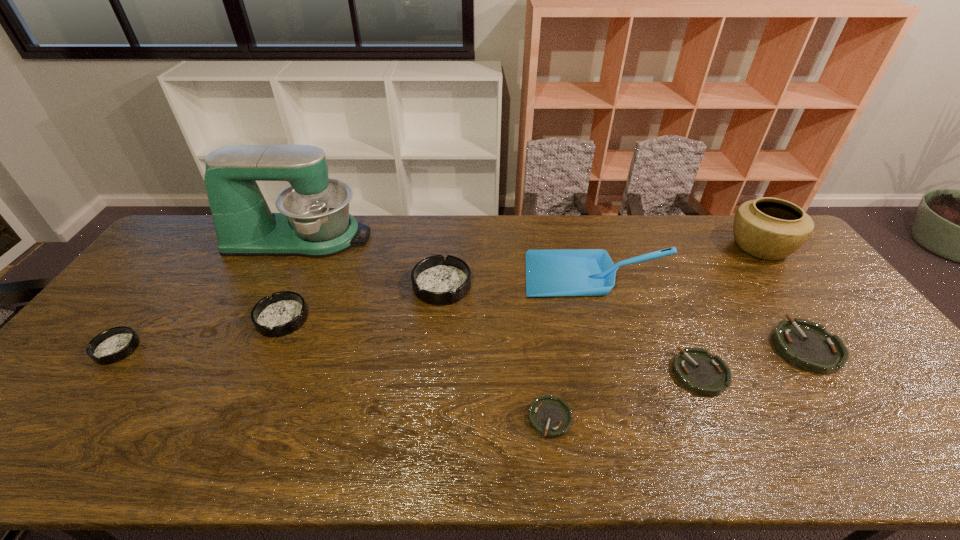
Image resolution: width=960 pixels, height=540 pixels. What are the coordinates of `unoccupied position between the leftmost ashtray and the mixer` in the screenshot? It's located at (208, 293).

This screenshot has height=540, width=960. In order to click on vacant area between the second ashtray from right to left and the leftmost ashtray in this screenshot , I will do `click(408, 361)`.

Where is `free space between the leftmost green ashtray and the dustpan`? The image size is (960, 540). free space between the leftmost green ashtray and the dustpan is located at coordinates pos(572,347).

I want to click on vacant point located between the dustpan and the second shortest ashtray, so click(647, 324).

Identify the location of blank region between the second dark ashtray from right to left and the pottery. The image size is (960, 540). (521, 283).

Locate an element on the screen. Image resolution: width=960 pixels, height=540 pixels. object that can be found as the second closest to the biggest green ashtray is located at coordinates (570, 272).

The width and height of the screenshot is (960, 540). Identify the location of the closest object relative to the shortest object. (696, 369).

At what (x,y) coordinates should I click in order to perform the action: click on ashtray that is the fourth closest to the second ashtray from left to right. Please return your answer as a coordinate pair (x, y). The width and height of the screenshot is (960, 540). Looking at the image, I should click on (696, 369).

Find the location of a particular element. the fifth closest ashtray relative to the rightmost green ashtray is located at coordinates (115, 344).

What are the coordinates of `the closest dark ashtray to the shortest ashtray` in the screenshot? It's located at (437, 280).